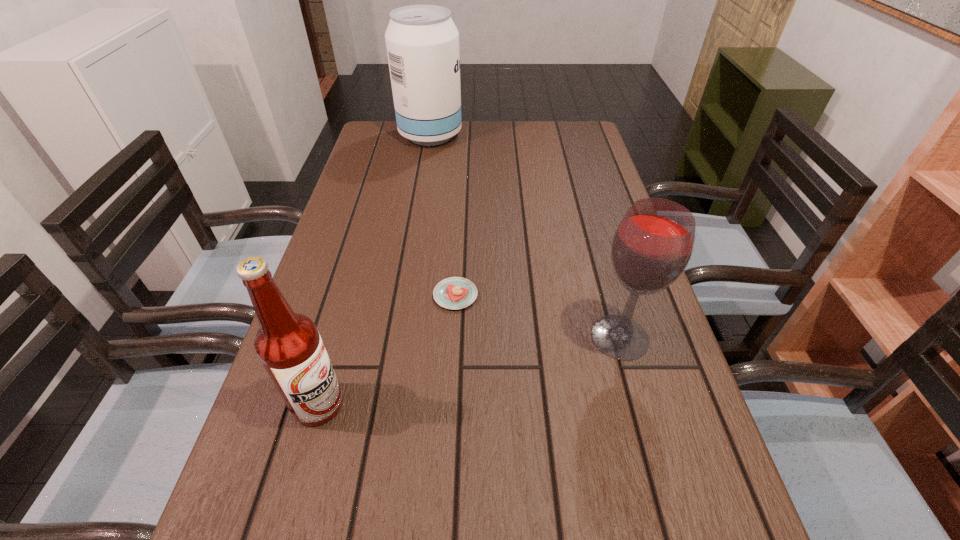
The height and width of the screenshot is (540, 960). In order to click on the farthest alcohol in this screenshot , I will do `click(422, 41)`.

Locate an element on the screen. the nearest object is located at coordinates (288, 344).

Locate an element on the screen. This screenshot has height=540, width=960. the second nearest alcohol is located at coordinates (651, 248).

Identify the location of the second nearest object. (651, 248).

Identify the location of the second farthest object. The width and height of the screenshot is (960, 540). (455, 292).

Locate an element on the screen. The height and width of the screenshot is (540, 960). pastry is located at coordinates (455, 292).

Find the location of a particular element. free region located 0.230m on the right of the farthest object is located at coordinates (532, 135).

Find the location of a particular element. The image size is (960, 540). vacant region located on the label side of the nearest alcohol is located at coordinates (511, 404).

Image resolution: width=960 pixels, height=540 pixels. I want to click on vacant area located on the front of the third farthest object, so click(x=652, y=453).

Where is `free spot located 0.140m on the back of the shortest object`? This screenshot has width=960, height=540. free spot located 0.140m on the back of the shortest object is located at coordinates (459, 239).